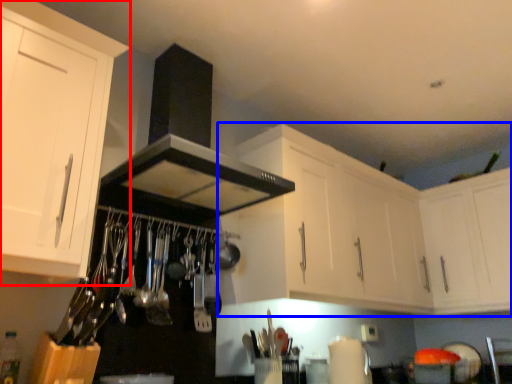
Question: Which of the following is the farthest to the observer, cabinetry (highlighted by a red box) or cabinetry (highlighted by a blue box)?

Choices:
 (A) cabinetry
 (B) cabinetry

Answer: (B)